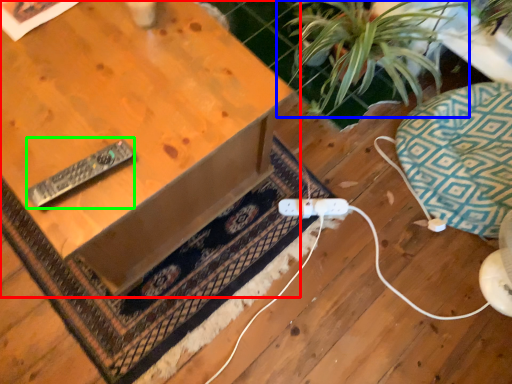
Question: Which is nearer to the table (highlighted by a red box)? houseplant (highlighted by a blue box) or remote (highlighted by a green box).

Choices:
 (A) houseplant
 (B) remote

Answer: (B)